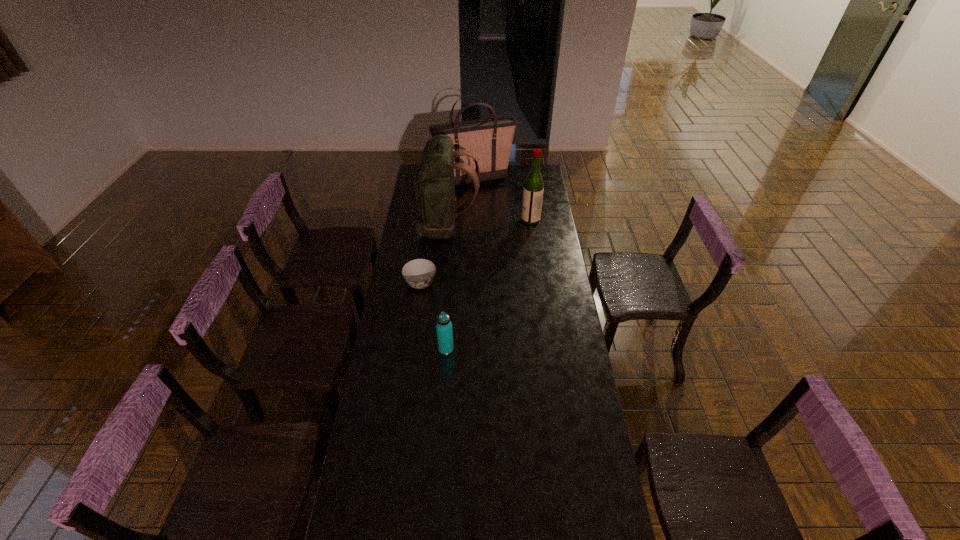
Find the location of a particular element. free spot that satisfies the following two spatial constraints: 1. on the front side of the shopping bag; 2. on the back of the backpack is located at coordinates (473, 226).

At what (x,y) coordinates should I click in order to perform the action: click on free point that satisfies the following two spatial constraints: 1. on the label of the liquor; 2. on the front side of the nearest object. Please return your answer as a coordinate pair (x, y). This screenshot has width=960, height=540. Looking at the image, I should click on (548, 349).